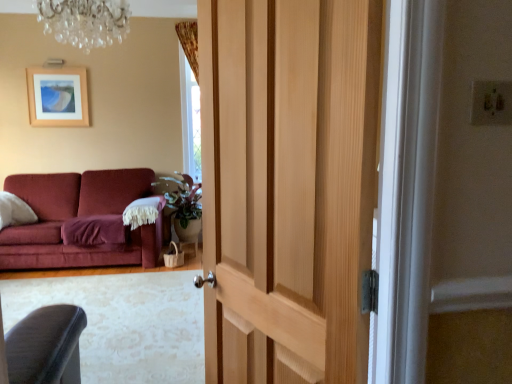
Question: Is crystal glass chandelier at upper center in front of or behind natural wood door at center in the image?

Choices:
 (A) front
 (B) behind

Answer: (B)

Question: Is crystal glass chandelier at upper center inside or outside of natural wood door at center?

Choices:
 (A) outside
 (B) inside

Answer: (A)

Question: Which is nearer to the crystal glass chandelier at upper center?

Choices:
 (A) fuzzy woolen blanket at left
 (B) wooden picture frame at upper left
 (C) natural wood door at center

Answer: (A)

Question: Estimate the real-world distances between objects in this image. Which object is closer to the natural wood door at center?

Choices:
 (A) crystal glass chandelier at upper center
 (B) wooden picture frame at upper left
 (C) fuzzy woolen blanket at left

Answer: (A)